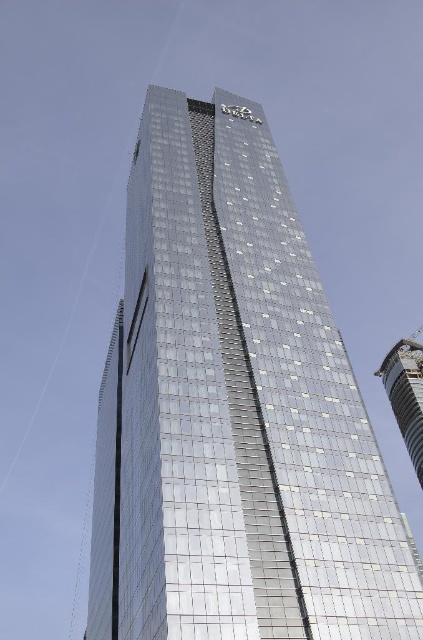
Question: Among these objects, which one is nearest to the camera?

Choices:
 (A) shiny metallic tower at right
 (B) shiny glass tower at center

Answer: (B)

Question: Is shiny glass tower at center thinner than shiny metallic tower at right?

Choices:
 (A) no
 (B) yes

Answer: (B)

Question: Does shiny glass tower at center have a smaller size compared to shiny metallic tower at right?

Choices:
 (A) yes
 (B) no

Answer: (A)

Question: Which of the following is the farthest from the observer?

Choices:
 (A) (214, 588)
 (B) (384, 378)

Answer: (B)

Question: Is shiny glass tower at center wider than shiny metallic tower at right?

Choices:
 (A) no
 (B) yes

Answer: (A)